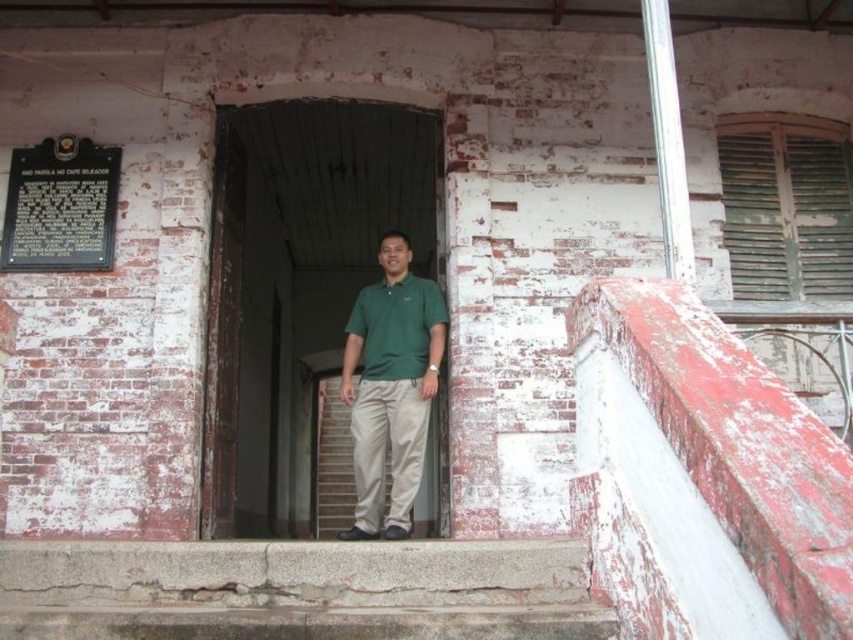
Question: Can you confirm if green matte shirt at center is positioned to the left of black metal plaque at upper left?

Choices:
 (A) yes
 (B) no

Answer: (B)

Question: Which object is the closest to the black metal plaque at upper left?

Choices:
 (A) green matte shirt at center
 (B) wooden door at center

Answer: (A)

Question: Based on their relative distances, which object is nearer to the black metal plaque at upper left?

Choices:
 (A) wooden door at center
 (B) green matte shirt at center
 (C) green cotton polo shirt at center

Answer: (C)

Question: Does wooden door at center appear on the left side of green cotton polo shirt at center?

Choices:
 (A) yes
 (B) no

Answer: (A)

Question: Does black metal plaque at upper left have a lesser width compared to green cotton polo shirt at center?

Choices:
 (A) yes
 (B) no

Answer: (B)

Question: Which of the following is the closest to the observer?

Choices:
 (A) black metal plaque at upper left
 (B) wooden door at center

Answer: (B)